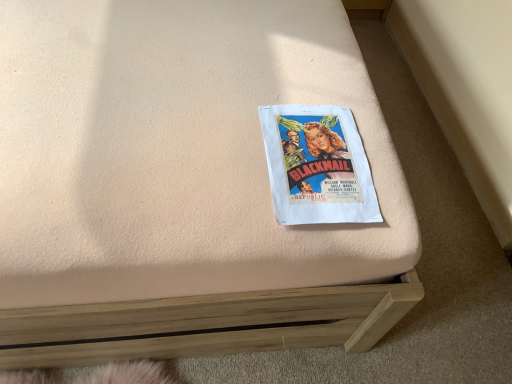
Locate an element on the screen. This screenshot has width=512, height=384. matte paper poster at center is located at coordinates (317, 166).

What do you see at coordinates (317, 166) in the screenshot?
I see `matte paper poster at center` at bounding box center [317, 166].

Find the location of a particular element. The image size is (512, 384). matte paper poster at center is located at coordinates [x=317, y=166].